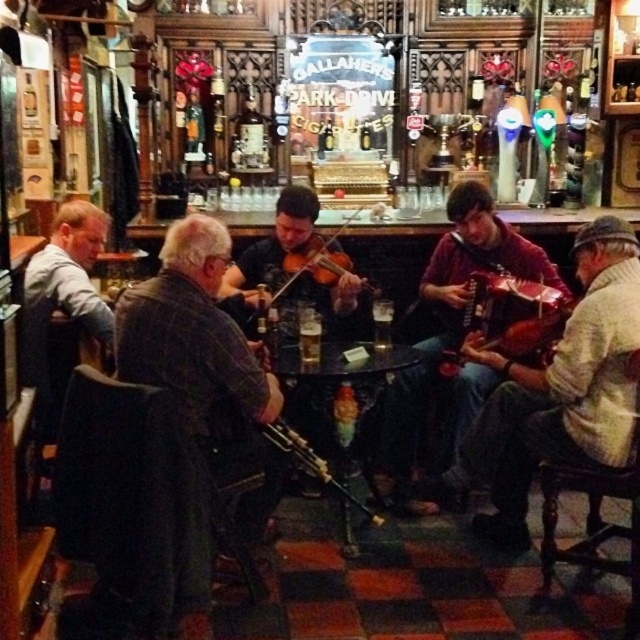
Question: From the image, what is the correct spatial relationship of wooden violin at center in relation to wooden bagpipe at center?

Choices:
 (A) below
 (B) above

Answer: (B)

Question: Which point is farther to the camera?

Choices:
 (A) maroon fabric accordion at center
 (B) gray wool sweater at left

Answer: (A)

Question: Considering the real-world distances, which object is closest to the gray wool sweater at left?

Choices:
 (A) dark brown leather jacket at center
 (B) maroon fabric accordion at center

Answer: (A)

Question: Does dark brown leather jacket at center have a larger size compared to gray wool sweater at left?

Choices:
 (A) no
 (B) yes

Answer: (B)

Question: Can you confirm if maroon fabric accordion at center is positioned below wooden violin at center?

Choices:
 (A) yes
 (B) no

Answer: (A)

Question: Estimate the real-world distances between objects in this image. Which object is closer to the dark brown leather jacket at center?

Choices:
 (A) wooden violin at center
 (B) maroon fabric accordion at center
 (C) wooden bagpipe at center
 (D) gray wool sweater at left

Answer: (C)